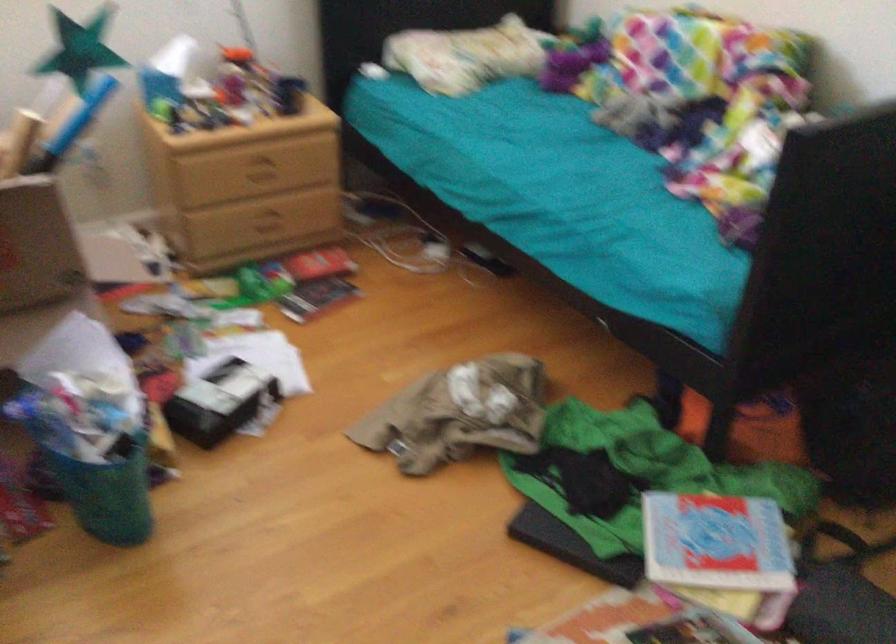
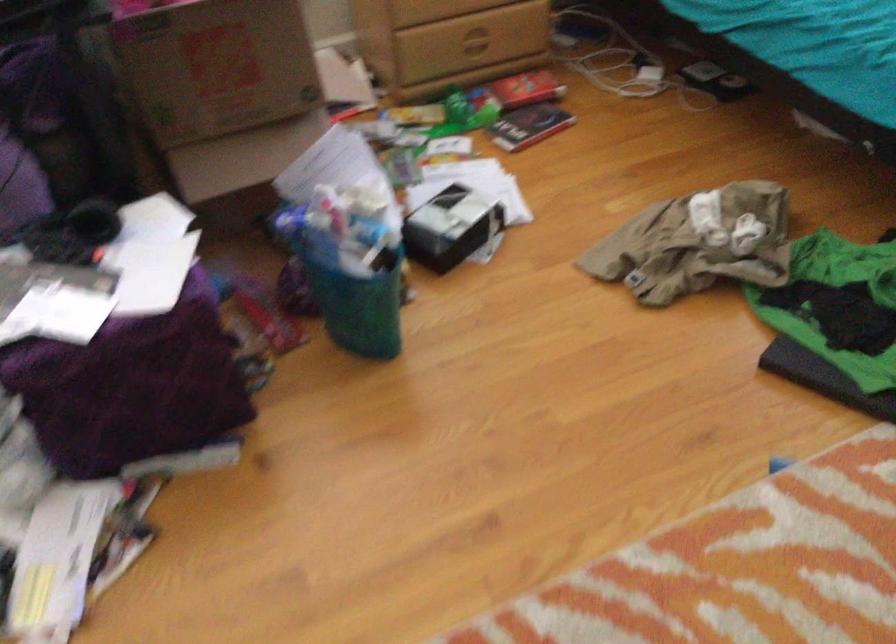
In the second image, find the point that corresponds to (264,218) in the first image.

(472, 40)